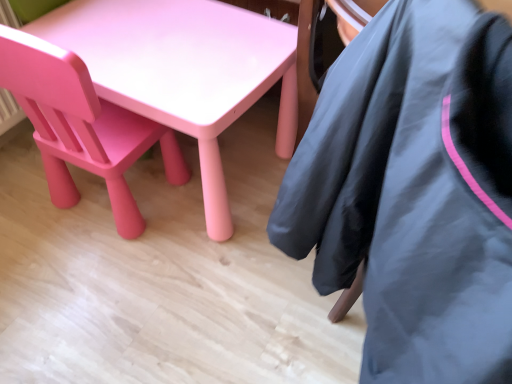
Question: Considering the positions of matte black jacket at lower right and matte pink plastic chair at lower left in the image, is matte black jacket at lower right bigger or smaller than matte pink plastic chair at lower left?

Choices:
 (A) small
 (B) big

Answer: (B)

Question: From a real-world perspective, relative to matte pink plastic chair at lower left, is matte black jacket at lower right vertically above or below?

Choices:
 (A) below
 (B) above

Answer: (B)

Question: In the image, is matte black jacket at lower right on the left side or the right side of matte pink plastic chair at lower left?

Choices:
 (A) left
 (B) right

Answer: (B)

Question: Considering the positions of matte pink plastic chair at lower left and matte black jacket at lower right in the image, is matte pink plastic chair at lower left taller or shorter than matte black jacket at lower right?

Choices:
 (A) tall
 (B) short

Answer: (B)

Question: From the image's perspective, is matte pink plastic chair at lower left located above or below matte black jacket at lower right?

Choices:
 (A) above
 (B) below

Answer: (A)

Question: Which is correct: matte pink plastic chair at lower left is inside matte black jacket at lower right, or outside of it?

Choices:
 (A) outside
 (B) inside

Answer: (A)

Question: Is matte pink plastic chair at lower left in front of or behind matte black jacket at lower right in the image?

Choices:
 (A) behind
 (B) front

Answer: (A)